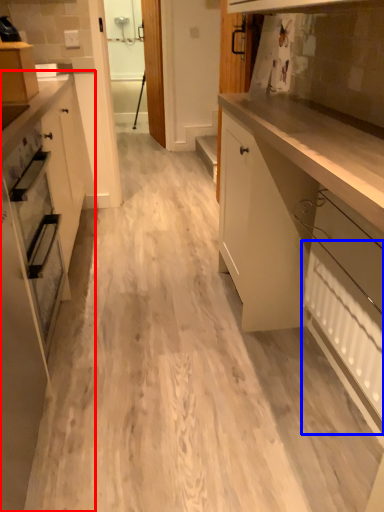
Question: Which object is closer to the camera taking this photo, cabinetry (highlighted by a red box) or radiator (highlighted by a blue box)?

Choices:
 (A) cabinetry
 (B) radiator

Answer: (A)